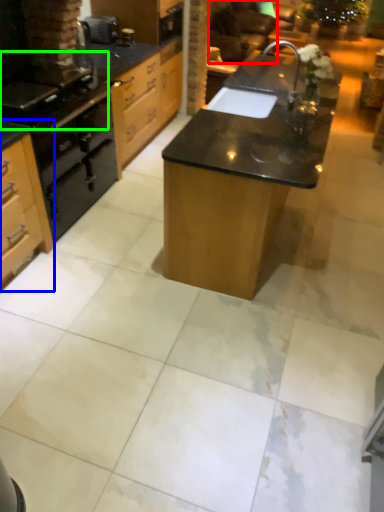
Question: Considering the real-world distances, which object is closest to armchair (highlighted by a red box)? cabinetry (highlighted by a blue box) or gas stove (highlighted by a green box).

Choices:
 (A) cabinetry
 (B) gas stove

Answer: (B)